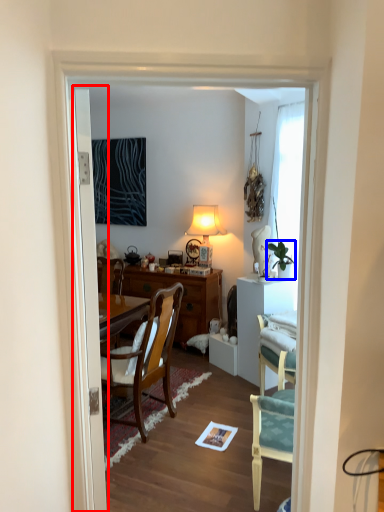
Question: Among these objects, which one is farthest to the camera, door (highlighted by a red box) or houseplant (highlighted by a blue box)?

Choices:
 (A) door
 (B) houseplant

Answer: (B)